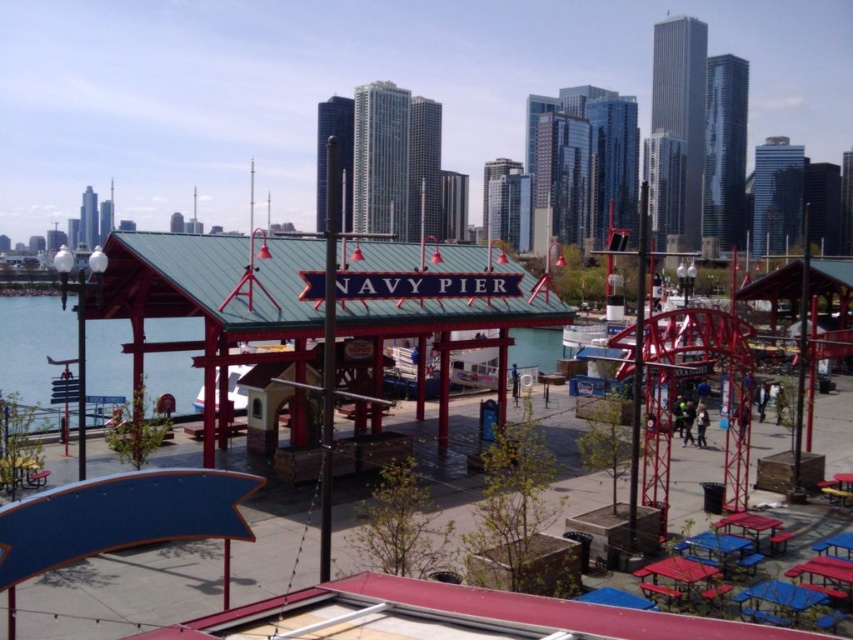
Does wooden picnic table at lower right have a greater width compared to blue plastic picnic table at lower right?

In fact, wooden picnic table at lower right might be narrower than blue plastic picnic table at lower right.

Describe the element at coordinates (680, 579) in the screenshot. This screenshot has height=640, width=853. I see `wooden picnic table at lower right` at that location.

Image resolution: width=853 pixels, height=640 pixels. I want to click on wooden picnic table at lower right, so click(x=680, y=579).

Can you confirm if blue plastic picnic table at lower right is positioned to the right of red plastic picnic table at lower right?

In fact, blue plastic picnic table at lower right is to the left of red plastic picnic table at lower right.

Does point (724, 545) come farther from viewer compared to point (770, 541)?

No.

The width and height of the screenshot is (853, 640). What are the coordinates of `blue plastic picnic table at lower right` in the screenshot? It's located at (720, 550).

Is point (717, 595) positioned after point (747, 529)?

No, (717, 595) is in front of (747, 529).

Who is lower down, wooden picnic table at lower right or red plastic picnic table at lower right?

wooden picnic table at lower right is below.

Which is behind, point (705, 582) or point (741, 515)?

The point (741, 515) is behind.

You are a GUI agent. You are given a task and a screenshot of the screen. Output one action in this format:
    pyautogui.click(x=<x>, y=<y>)
    Task: Click on the wooden picnic table at lower right
    This screenshot has height=640, width=853.
    Given the screenshot: What is the action you would take?
    pyautogui.click(x=680, y=579)